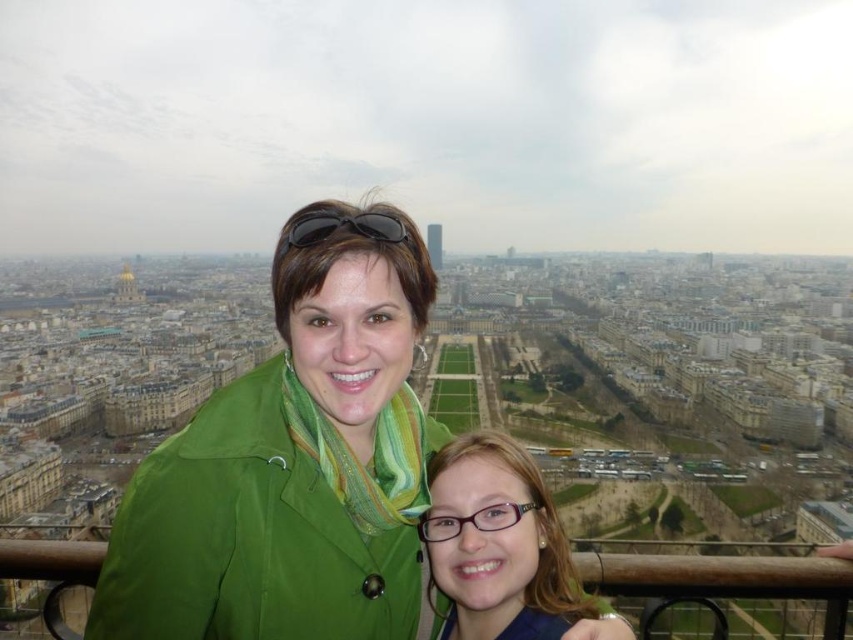
You are a photographer trying to capture a clear shot of both jackets in the scene. Given that the green fabric jacket at center and the matte green jacket at center are both in focus, which one appears bigger in your photo?

The green fabric jacket at center appears bigger in the photo because it is larger in size than the matte green jacket at center.

You are a photographer trying to capture a closeup shot of the matte green jacket at center and the black matte sunglasses at center. Given that the camera lens can only focus on objects within a 10cm diameter, will both objects fit in the frame if they are placed side by side?

The matte green jacket at center is larger in size than the black matte sunglasses at center. Since the camera lens can only focus on objects within a 10cm diameter, both objects may not fit in the frame when placed side by side, as their combined size might exceed the 10cm limit.

You are a photographer trying to capture a photo of the two people in the foreground while ensuring both the green fabric jacket at center and the black matte sunglasses at center are clearly visible. Which object should you focus on first to ensure both are in sharp focus?

The green fabric jacket at center is positioned on the left side of black matte sunglasses at center. Since the jacket is closer to the left edge and the sunglasses are centrally placed, focusing on the black matte sunglasses at center would ensure both are in focus as they are within a similar focal plane.